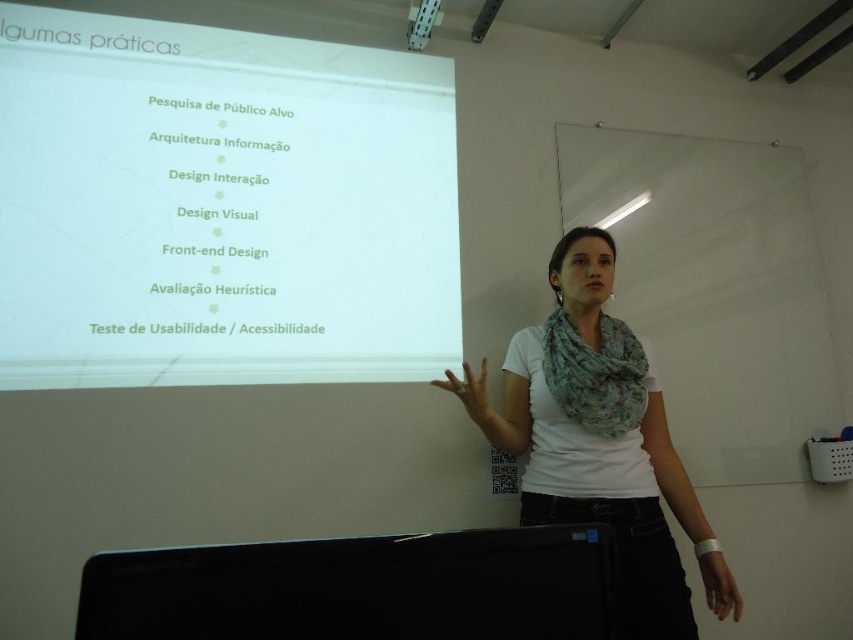
Looking at this image, you are a student sitting at the back of the classroom. You need to read the text on the black glossy monitor at lower center and the white fabric scarf at center. Which one do you think will be easier to read from your current position?

The white fabric scarf at center is taller than the black glossy monitor at lower center, so it will be easier to read from the back of the classroom.

You are a student sitting at the back of the classroom. You need to read the text on the black glossy monitor at lower center and the white fabric scarf at center. Which one do you think will be easier to read from your current position?

The white fabric scarf at center is larger than the black glossy monitor at lower center, so it will be easier to read from the back of the classroom.

From the picture: You are sitting in the front row of the classroom and want to look at both the point at position (16,253) and the point at position (421,10) on the projection screen. Which point will appear closer to you?

The point at position (16,253) will appear closer to you because it is closer to the viewer than the point at position (421,10).